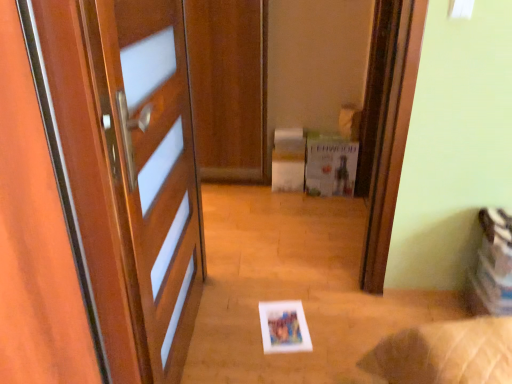
Question: Is point (326, 135) positioned closer to the camera than point (377, 211)?

Choices:
 (A) farther
 (B) closer

Answer: (A)

Question: In terms of height, does white paper postcard at center look taller or shorter compared to transparent glass screen door at upper center?

Choices:
 (A) short
 (B) tall

Answer: (A)

Question: From a real-world perspective, is white paper postcard at center positioned above or below transparent glass screen door at upper center?

Choices:
 (A) above
 (B) below

Answer: (B)

Question: Based on their positions, is transparent glass screen door at upper center located to the left or right of white paper postcard at center?

Choices:
 (A) right
 (B) left

Answer: (A)

Question: From the image's perspective, is transparent glass screen door at upper center above or below white paper postcard at center?

Choices:
 (A) below
 (B) above

Answer: (B)

Question: From a real-world perspective, is transparent glass screen door at upper center above or below white paper postcard at center?

Choices:
 (A) below
 (B) above

Answer: (B)

Question: In terms of width, does transparent glass screen door at upper center look wider or thinner when compared to white paper postcard at center?

Choices:
 (A) wide
 (B) thin

Answer: (B)